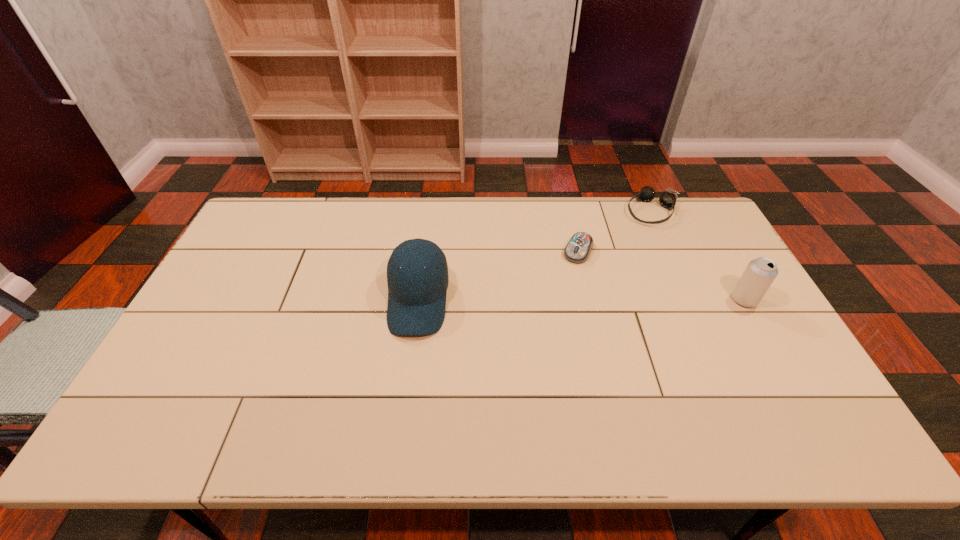
Locate an element on the screen. The height and width of the screenshot is (540, 960). the leftmost object is located at coordinates (417, 291).

Locate an element on the screen. beer can is located at coordinates (760, 273).

Image resolution: width=960 pixels, height=540 pixels. In order to click on the third nearest object in this screenshot , I will do `click(578, 249)`.

Find the location of a particular element. The width and height of the screenshot is (960, 540). the third object from right to left is located at coordinates (578, 249).

At what (x,y) coordinates should I click in order to perform the action: click on the second object from right to left. Please return your answer as a coordinate pair (x, y). The image size is (960, 540). Looking at the image, I should click on (667, 199).

Locate an element on the screen. This screenshot has width=960, height=540. goggles is located at coordinates coord(667,199).

The height and width of the screenshot is (540, 960). I want to click on vacant area situated 0.170m on the front-facing side of the leftmost object, so click(x=405, y=397).

The height and width of the screenshot is (540, 960). I want to click on vacant space located on the back of the beer can, so click(x=724, y=263).

Image resolution: width=960 pixels, height=540 pixels. In order to click on vacant area situated 0.170m on the wheel side of the shortest object in this screenshot , I will do `click(555, 299)`.

Find the location of a particular element. The image size is (960, 540). free location located 0.090m on the wheel side of the shortest object is located at coordinates (564, 281).